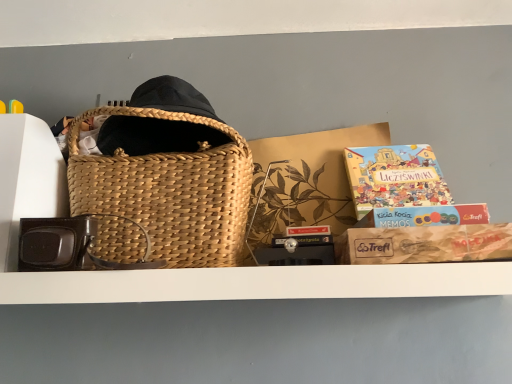
This screenshot has height=384, width=512. What are the coordinates of `vacant space situated above matte brown cardboard box at center (from a real-world perspective)` in the screenshot? It's located at [307, 127].